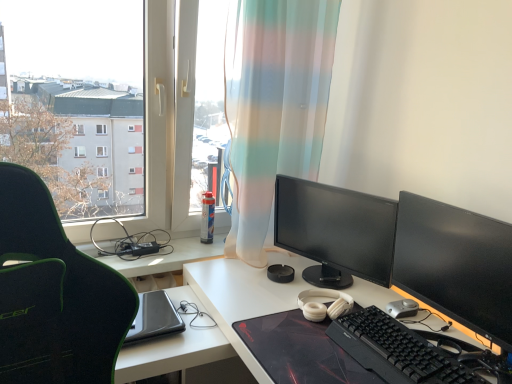
Question: From the image's perspective, is white matte desk at center beneath black glossy monitor at right, the second computer monitor viewed from the back?

Choices:
 (A) yes
 (B) no

Answer: (A)

Question: Can you confirm if white matte desk at center is bigger than black glossy monitor at right, the first computer monitor in the front-to-back sequence?

Choices:
 (A) yes
 (B) no

Answer: (A)

Question: Is white matte desk at center not close to black glossy monitor at right, the second computer monitor viewed from the back?

Choices:
 (A) no
 (B) yes

Answer: (A)

Question: From the image's perspective, would you say white matte desk at center is positioned over black glossy monitor at right, the second computer monitor viewed from the back?

Choices:
 (A) yes
 (B) no

Answer: (B)

Question: From a real-world perspective, is white matte desk at center located higher than black glossy monitor at right, the first computer monitor in the front-to-back sequence?

Choices:
 (A) yes
 (B) no

Answer: (B)

Question: Considering the relative sizes of white matte desk at center and black glossy monitor at right, the first computer monitor in the front-to-back sequence, in the image provided, is white matte desk at center shorter than black glossy monitor at right, the first computer monitor in the front-to-back sequence,?

Choices:
 (A) yes
 (B) no

Answer: (B)

Question: From the image's perspective, is transparent plastic window at upper left above matte black monitor at center, which ranks as the 1th computer monitor in back-to-front order?

Choices:
 (A) no
 (B) yes

Answer: (B)

Question: Is transparent plastic window at upper left not within matte black monitor at center, positioned as the 2th computer monitor in front-to-back order?

Choices:
 (A) no
 (B) yes

Answer: (B)

Question: Is the depth of transparent plastic window at upper left less than that of matte black monitor at center, which ranks as the 1th computer monitor in back-to-front order?

Choices:
 (A) yes
 (B) no

Answer: (A)

Question: Is transparent plastic window at upper left bigger than matte black monitor at center, positioned as the 2th computer monitor in front-to-back order?

Choices:
 (A) no
 (B) yes

Answer: (B)

Question: Is matte black monitor at center, which ranks as the 1th computer monitor in back-to-front order, inside transparent plastic window at upper left?

Choices:
 (A) yes
 (B) no

Answer: (B)

Question: Would you say transparent plastic window at upper left is a long distance from matte black monitor at center, which ranks as the 1th computer monitor in back-to-front order?

Choices:
 (A) no
 (B) yes

Answer: (A)

Question: Is black plastic keyboard at lower right bigger than silver metallic mouse at lower right?

Choices:
 (A) no
 (B) yes

Answer: (B)